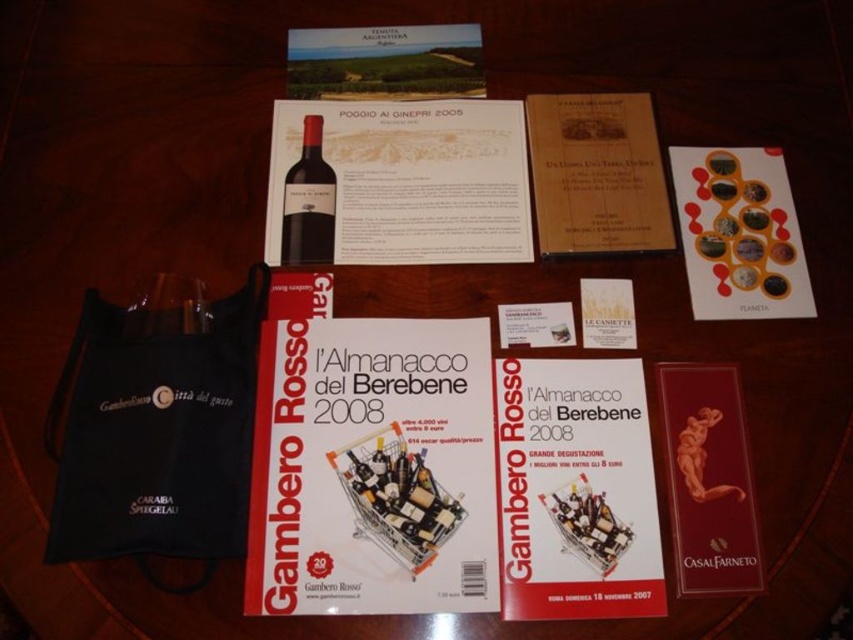
Question: Among these objects, which one is farthest from the camera?

Choices:
 (A) red glossy book at center
 (B) wooden menu at upper center
 (C) black fabric bag at lower left

Answer: (B)

Question: From the image, what is the correct spatial relationship of white paper at center in relation to matte paper menu at upper center?

Choices:
 (A) below
 (B) above

Answer: (A)

Question: Which point is farther to the camera?

Choices:
 (A) (611, 609)
 (B) (399, 179)
 (C) (727, 432)
 (D) (625, 195)

Answer: (B)

Question: Which point is closer to the camera taking this photo?

Choices:
 (A) (454, 92)
 (B) (689, 394)
 (C) (265, 284)

Answer: (B)

Question: Does matte orange card at upper right have a lesser width compared to shiny dark red bottle at center?

Choices:
 (A) yes
 (B) no

Answer: (B)

Question: Does matte orange card at upper right lie in front of shiny dark red bottle at center?

Choices:
 (A) no
 (B) yes

Answer: (B)